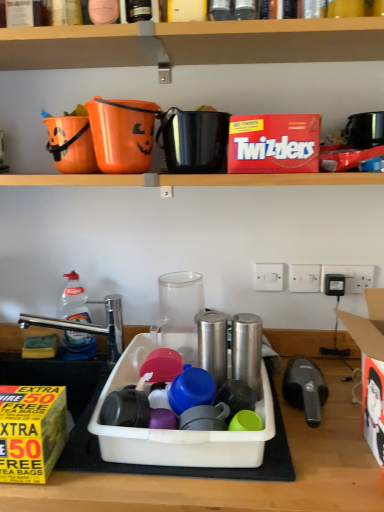
Measure the distance between chrome metallic faucet at left and camera.

3.96 feet.

Where is `orange plastic bucket at upper center, the 2th appliance viewed from the top`? This screenshot has width=384, height=512. orange plastic bucket at upper center, the 2th appliance viewed from the top is located at coordinates (122, 134).

Measure the distance between point (68, 284) and camera.

1.27 meters.

This screenshot has width=384, height=512. Describe the element at coordinates (193, 42) in the screenshot. I see `wooden shelf at upper center` at that location.

What is the approximate width of white plastic switch at upper center, which ranks as the third electric outlet in right-to-left order?

It is 0.62 inches.

Locate an element on the screen. chrome metallic faucet at left is located at coordinates (89, 325).

From the image's perspective, which is above, white plastic switch at upper center, placed as the 1th electric outlet when sorted from left to right, or silver metallic canister at center, the 5th appliance when ordered from top to bottom?

white plastic switch at upper center, placed as the 1th electric outlet when sorted from left to right, from the image's perspective.

Which of these two, white plastic switch at upper center, which ranks as the third electric outlet in right-to-left order, or silver metallic canister at center, which is counted as the 2th appliance, starting from the right, is wider?

With larger width is silver metallic canister at center, which is counted as the 2th appliance, starting from the right.

Considering the positions of point (271, 278) and point (252, 329), is point (271, 278) closer or farther from the camera than point (252, 329)?

Point (271, 278).

Is white plastic switch at upper center, placed as the 1th electric outlet when sorted from left to right, located outside silver metallic canister at center, which is counted as the first appliance, starting from the bottom?

Absolutely, white plastic switch at upper center, placed as the 1th electric outlet when sorted from left to right, is external to silver metallic canister at center, which is counted as the first appliance, starting from the bottom.

Would you consider chrome metallic faucet at left to be distant from silver metallic canister at center, which is counted as the 2th appliance, starting from the right?

Actually, chrome metallic faucet at left and silver metallic canister at center, which is counted as the 2th appliance, starting from the right, are a little close together.

Is chrome metallic faucet at left aimed at silver metallic canister at center, the 5th appliance when ordered from top to bottom?

No, chrome metallic faucet at left is not oriented towards silver metallic canister at center, the 5th appliance when ordered from top to bottom.

From the image's perspective, is chrome metallic faucet at left located above or below silver metallic canister at center, which is counted as the 2th appliance, starting from the right?

Based on their image positions, chrome metallic faucet at left is located above silver metallic canister at center, which is counted as the 2th appliance, starting from the right.

Consider the image. Considering the sizes of objects chrome metallic faucet at left and silver metallic canister at center, which is counted as the first appliance, starting from the bottom, in the image provided, who is taller, chrome metallic faucet at left or silver metallic canister at center, which is counted as the first appliance, starting from the bottom,?

chrome metallic faucet at left.

From the image's perspective, is white cardboard lunch box at right above or below yellow paper box at lower left, which ranks as the first box in left-to-right order?

Clearly, from the image's perspective, white cardboard lunch box at right is above yellow paper box at lower left, which ranks as the first box in left-to-right order.

From a real-world perspective, is white cardboard lunch box at right on top of yellow paper box at lower left, which ranks as the first box in left-to-right order?

Yes, from a real-world perspective, white cardboard lunch box at right is on top of yellow paper box at lower left, which ranks as the first box in left-to-right order.

How different are the orientations of white cardboard lunch box at right and yellow paper box at lower left, arranged as the second box when viewed from the right, in degrees?

There is a 5.08-degree angle between the facing directions of white cardboard lunch box at right and yellow paper box at lower left, arranged as the second box when viewed from the right.

Could you tell me if wooden shelf at upper center is turned towards white plastic electric outlet at center, the second electric outlet from the left?

No, wooden shelf at upper center is not facing towards white plastic electric outlet at center, the second electric outlet from the left.

Is point (244, 61) farther from viewer compared to point (294, 269)?

No, it is not.

Based on the photo, is wooden shelf at upper center directly adjacent to white plastic electric outlet at center, the second electric outlet positioned from the right?

No, wooden shelf at upper center is not beside white plastic electric outlet at center, the second electric outlet positioned from the right.

From the image's perspective, which one is positioned lower, wooden shelf at upper center or white plastic electric outlet at center, the second electric outlet positioned from the right?

white plastic electric outlet at center, the second electric outlet positioned from the right, from the image's perspective.

Is chrome metallic faucet at left oriented towards orange plastic bucket at upper center, the 2th appliance viewed from the top?

No, chrome metallic faucet at left is not facing towards orange plastic bucket at upper center, the 2th appliance viewed from the top.

Can you confirm if chrome metallic faucet at left is positioned to the left of orange plastic bucket at upper center, arranged as the 4th appliance when ordered from the bottom?

Yes, chrome metallic faucet at left is to the left of orange plastic bucket at upper center, arranged as the 4th appliance when ordered from the bottom.

Considering the points (75, 323) and (117, 105), which point is in front, point (75, 323) or point (117, 105)?

The point (117, 105) is in front.

Is chrome metallic faucet at left taller than orange plastic bucket at upper center, the first appliance in the left-to-right sequence?

Yes, chrome metallic faucet at left is taller than orange plastic bucket at upper center, the first appliance in the left-to-right sequence.

In terms of size, does white plastic electric outlet at center, the second electric outlet from the left, appear bigger or smaller than clear plastic bottle at left?

In the image, white plastic electric outlet at center, the second electric outlet from the left, appears to be smaller than clear plastic bottle at left.

From a real-world perspective, is white plastic electric outlet at center, the second electric outlet from the left, on clear plastic bottle at left?

Yes, from a real-world perspective, white plastic electric outlet at center, the second electric outlet from the left, is over clear plastic bottle at left

Measure the distance from white plastic electric outlet at center, the second electric outlet positioned from the right, to clear plastic bottle at left.

white plastic electric outlet at center, the second electric outlet positioned from the right, and clear plastic bottle at left are 26.05 inches apart from each other.

Considering their positions, is white plastic electric outlet at center, the second electric outlet positioned from the right, located in front of or behind clear plastic bottle at left?

In the image, white plastic electric outlet at center, the second electric outlet positioned from the right, appears behind clear plastic bottle at left.

Is white plastic container at center to the left of white plastic switch at upper center, placed as the 1th electric outlet when sorted from left to right, from the viewer's perspective?

Correct, you'll find white plastic container at center to the left of white plastic switch at upper center, placed as the 1th electric outlet when sorted from left to right.

Considering the sizes of objects white plastic container at center and white plastic switch at upper center, placed as the 1th electric outlet when sorted from left to right, in the image provided, who is thinner, white plastic container at center or white plastic switch at upper center, placed as the 1th electric outlet when sorted from left to right,?

With smaller width is white plastic switch at upper center, placed as the 1th electric outlet when sorted from left to right.

Do you think white plastic container at center is within white plastic switch at upper center, which ranks as the third electric outlet in right-to-left order, or outside of it?

white plastic container at center cannot be found inside white plastic switch at upper center, which ranks as the third electric outlet in right-to-left order.

Considering the points (144, 449) and (263, 269), which point is in front, point (144, 449) or point (263, 269)?

Positioned in front is point (144, 449).

Identify the location of the 2nd appliance below the white plastic switch at upper center, placed as the 1th electric outlet when sorted from left to right (from the image's perspective). (247, 351).

The image size is (384, 512). Find the location of `appliance that is the 4th one when counting rightward from the chrome metallic faucet at left`. appliance that is the 4th one when counting rightward from the chrome metallic faucet at left is located at coordinates (247, 351).

Looking at this image, from the image, which object appears to be nearer to white plastic electric outlet at center, the second electric outlet from the left, white cardboard lunch box at right or white plastic switch at upper center, which ranks as the third electric outlet in right-to-left order?

white plastic switch at upper center, which ranks as the third electric outlet in right-to-left order.

Considering their positions, is white plastic switch at upper center, placed as the 1th electric outlet when sorted from left to right, positioned closer to red cardboard box at upper center, positioned as the second box in front-to-back order, than black plastic kettle at upper right, which is the 1th appliance in right-to-left order?

black plastic kettle at upper right, which is the 1th appliance in right-to-left order, lies closer to red cardboard box at upper center, positioned as the second box in front-to-back order, than the other object.

Which object lies nearer to the anchor point wooden shelf at upper center, silver metallic canister at center, the 4th appliance positioned from the left, or white plastic container at center?

The object closer to wooden shelf at upper center is silver metallic canister at center, the 4th appliance positioned from the left.

Estimate the real-world distances between objects in this image. Which object is further from wooden shelf at upper center, white plastic switch at upper center, placed as the 1th electric outlet when sorted from left to right, or chrome metallic faucet at left?

chrome metallic faucet at left lies further to wooden shelf at upper center than the other object.

Looking at the image, which one is located further to silver metallic canister at center, the 4th appliance positioned from the left, white cardboard lunch box at right or clear plastic bottle at left?

The object further to silver metallic canister at center, the 4th appliance positioned from the left, is clear plastic bottle at left.

Based on their spatial positions, is wooden shelf at upper center or plastic container at center further from silver metallic canister at center, which is counted as the 2th appliance, starting from the right?

Based on the image, wooden shelf at upper center appears to be further to silver metallic canister at center, which is counted as the 2th appliance, starting from the right.

Looking at the image, which one is located closer to white plastic electric outlet at upper right, placed as the first electric outlet when sorted from right to left, yellow paper box at lower left, which appears as the 2th box when viewed from the back, or white plastic container at center?

white plastic container at center.

Estimate the real-world distances between objects in this image. Which object is closer to plastic container at center, black plastic kettle at upper right, which is the 1th appliance in right-to-left order, or white plastic switch at upper center, placed as the 1th electric outlet when sorted from left to right?

white plastic switch at upper center, placed as the 1th electric outlet when sorted from left to right, is closer to plastic container at center.

Find the location of `box situated between orange plastic bucket at upper center, the 2th appliance viewed from the top, and white plastic electric outlet at upper right, placed as the first electric outlet when sorted from right to left, from left to right`. box situated between orange plastic bucket at upper center, the 2th appliance viewed from the top, and white plastic electric outlet at upper right, placed as the first electric outlet when sorted from right to left, from left to right is located at coordinates (274, 143).

The image size is (384, 512). In order to click on bottle between orange plastic bucket at upper center, the first appliance in the left-to-right sequence, and white plastic container at center, in the vertical direction in this screenshot , I will do `click(74, 300)`.

This screenshot has height=512, width=384. What are the coordinates of `electric outlet situated between orange plastic bucket at upper center, marked as the fifth appliance in a right-to-left arrangement, and white plastic electric outlet at center, the second electric outlet positioned from the right, from left to right` in the screenshot? It's located at (268, 276).

You are a GUI agent. You are given a task and a screenshot of the screen. Output one action in this format:
    pyautogui.click(x=<x>, y=<y>)
    Task: Click on the box between glossy plastic bucket at upper center, positioned as the 4th appliance in right-to-left order, and shiny metallic thermos at center, positioned as the second appliance in bottom-to-top order, in the vertical direction
    
    Given the screenshot: What is the action you would take?
    pyautogui.click(x=274, y=143)